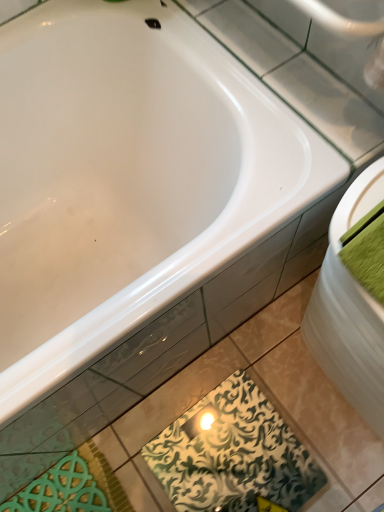
Question: From the image's perspective, is white glossy sink at right over green patterned tile at lower center?

Choices:
 (A) no
 (B) yes

Answer: (B)

Question: Can you confirm if white glossy sink at right is bigger than green patterned tile at lower center?

Choices:
 (A) no
 (B) yes

Answer: (B)

Question: From the image's perspective, is white glossy sink at right located beneath green patterned tile at lower center?

Choices:
 (A) no
 (B) yes

Answer: (A)

Question: Considering the relative sizes of white glossy sink at right and green patterned tile at lower center in the image provided, is white glossy sink at right smaller than green patterned tile at lower center?

Choices:
 (A) no
 (B) yes

Answer: (A)

Question: Is white glossy sink at right shorter than green patterned tile at lower center?

Choices:
 (A) yes
 (B) no

Answer: (B)

Question: Does white glossy sink at right come behind green patterned tile at lower center?

Choices:
 (A) no
 (B) yes

Answer: (A)

Question: Is green fabric towel at right closer to the viewer compared to white glossy sink at right?

Choices:
 (A) yes
 (B) no

Answer: (A)

Question: Could you tell me if green fabric towel at right is turned towards white glossy sink at right?

Choices:
 (A) yes
 (B) no

Answer: (B)

Question: Considering the relative sizes of green fabric towel at right and white glossy sink at right in the image provided, is green fabric towel at right shorter than white glossy sink at right?

Choices:
 (A) no
 (B) yes

Answer: (B)

Question: From a real-world perspective, is green fabric towel at right located higher than white glossy sink at right?

Choices:
 (A) yes
 (B) no

Answer: (A)

Question: Does green fabric towel at right have a lesser width compared to white glossy sink at right?

Choices:
 (A) no
 (B) yes

Answer: (A)

Question: Can you confirm if green fabric towel at right is bigger than white glossy sink at right?

Choices:
 (A) yes
 (B) no

Answer: (B)

Question: Is green patterned tile at lower center smaller than white glossy sink at right?

Choices:
 (A) yes
 (B) no

Answer: (A)